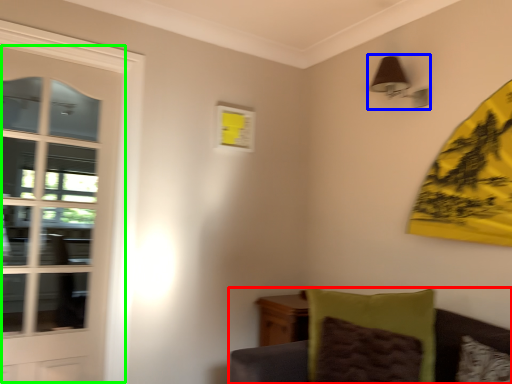
Question: Which is farther away from furniture (highlighted by a red box)? light fixture (highlighted by a blue box) or door (highlighted by a green box)?

Choices:
 (A) light fixture
 (B) door

Answer: (B)